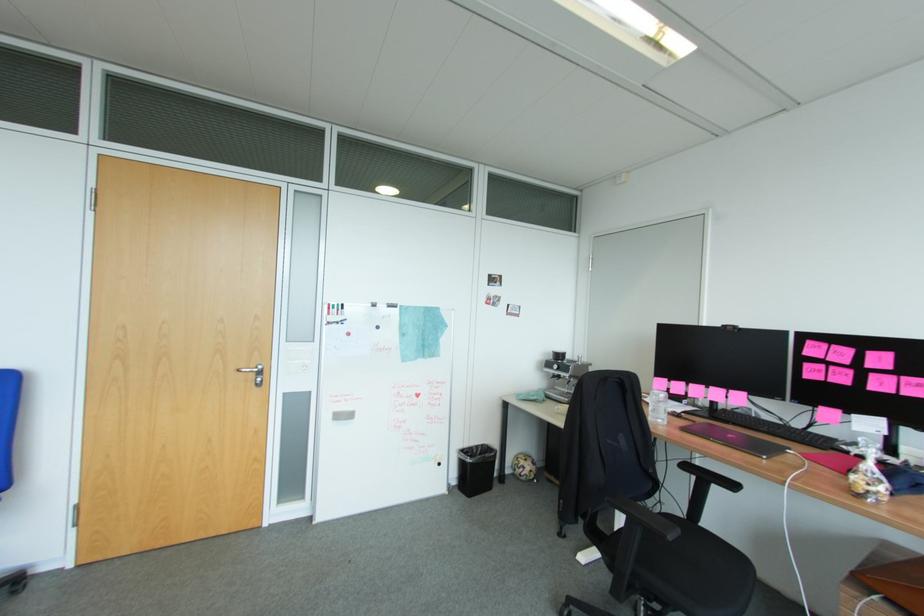
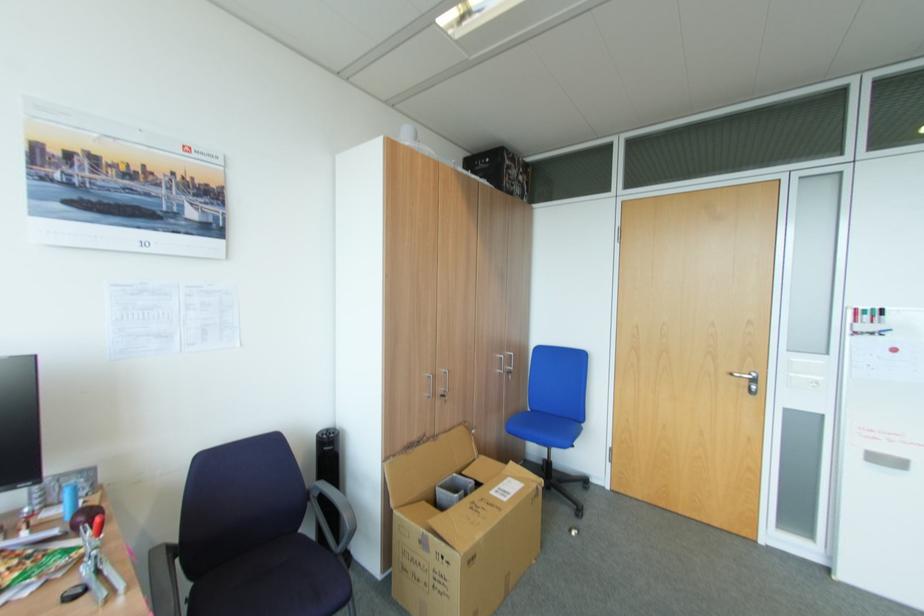
Where in the second image is the point corresponding to (343,310) from the first image?

(880, 317)